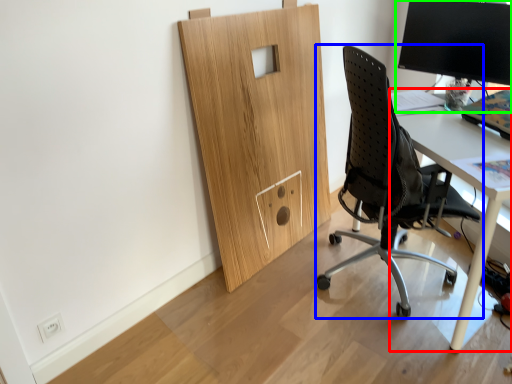
Question: Considering the real-world distances, which object is farthest from desk (highlighted by a red box)? chair (highlighted by a blue box) or desktop computer (highlighted by a green box)?

Choices:
 (A) chair
 (B) desktop computer

Answer: (B)